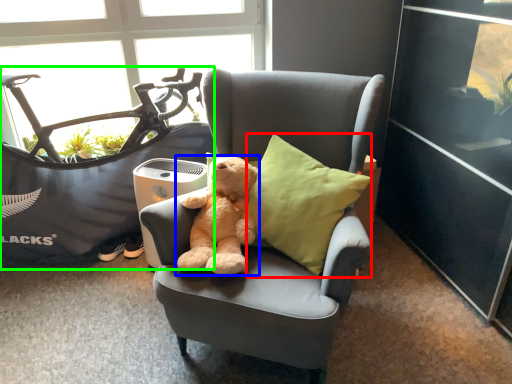
Question: Which is farther away from pillow (highlighted by a red box)? teddy bear (highlighted by a blue box) or mountain bike (highlighted by a green box)?

Choices:
 (A) teddy bear
 (B) mountain bike

Answer: (B)